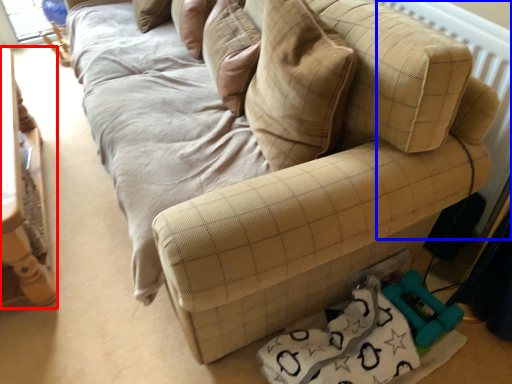
Question: Which object is closer to the camera taking this photo, furniture (highlighted by a red box) or radiator (highlighted by a blue box)?

Choices:
 (A) furniture
 (B) radiator

Answer: (A)